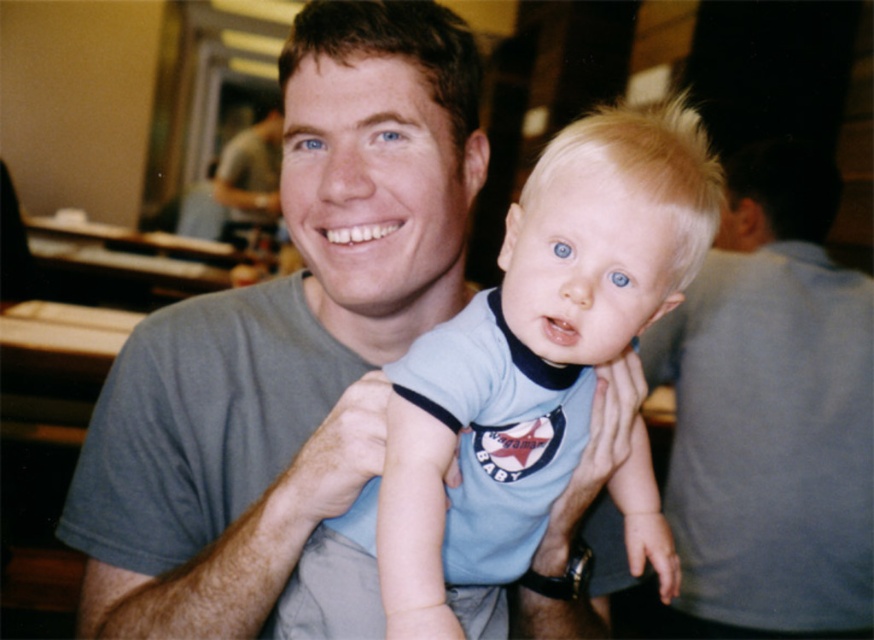
Who is shorter, gray cotton shirt at center or light blue cotton shirt at center?

With less height is light blue cotton shirt at center.

Is point (286, 216) less distant than point (623, 196)?

No, it is behind (623, 196).

Is point (358, 28) behind point (681, 144)?

Yes, it is.

This screenshot has height=640, width=874. I want to click on gray cotton shirt at center, so click(x=286, y=337).